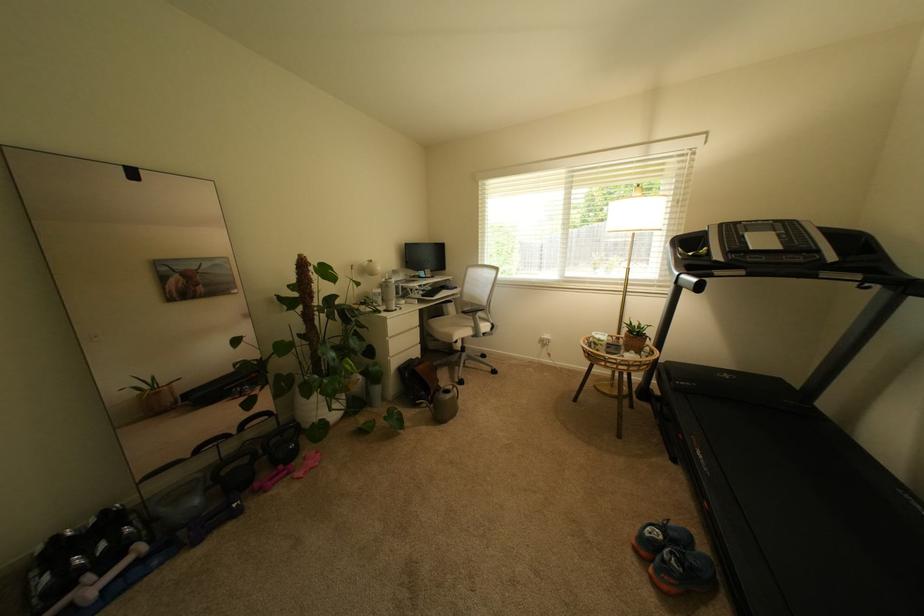
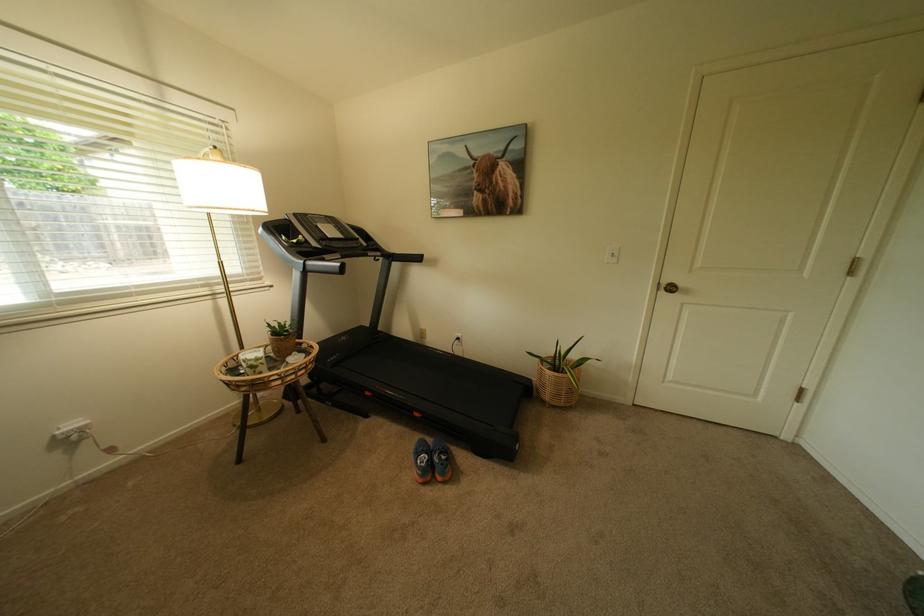
How did the camera likely rotate?

The rotation direction of the camera is right-down.